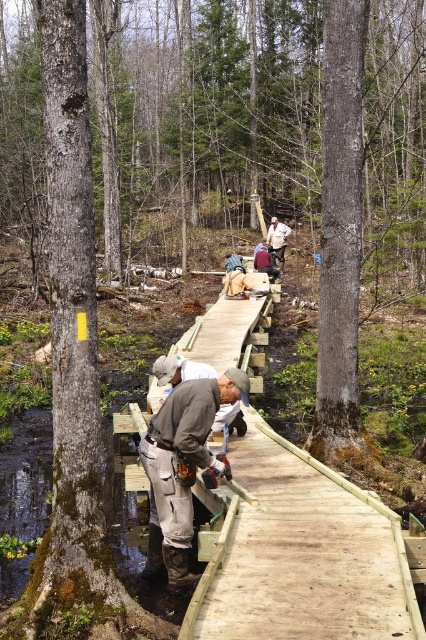
Question: Which object appears farthest from the camera in this image?

Choices:
 (A) white cotton shirt at upper center
 (B) brown leather boots at center

Answer: (A)

Question: Is brown leather boots at center below khaki fabric pants at center?

Choices:
 (A) no
 (B) yes

Answer: (B)

Question: Based on their relative distances, which object is farther from the khaki fabric pants at center?

Choices:
 (A) smooth gray bark at center
 (B) white cotton shirt at upper center

Answer: (B)

Question: Can you confirm if brown leather boots at center is thinner than khaki fabric pants at center?

Choices:
 (A) no
 (B) yes

Answer: (A)

Question: Considering the real-world distances, which object is closest to the khaki fabric pants at center?

Choices:
 (A) brown leather boots at center
 (B) white cotton shirt at upper center
 (C) smooth gray bark at center

Answer: (A)

Question: Does brown leather boots at center lie behind white cotton shirt at upper center?

Choices:
 (A) yes
 (B) no

Answer: (B)